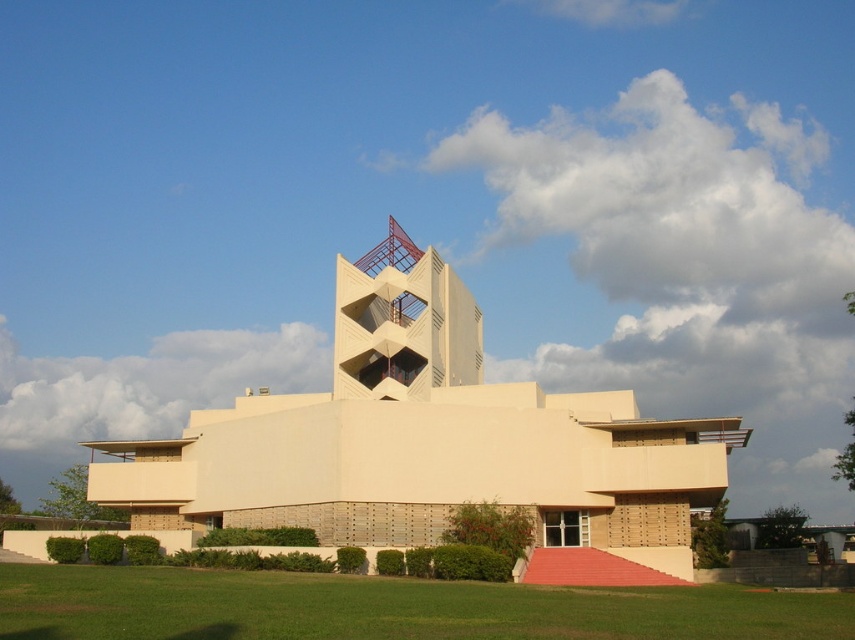
Can you confirm if beige concrete building at center is smaller than green grass at lower center?

No, beige concrete building at center is not smaller than green grass at lower center.

Is beige concrete building at center thinner than green grass at lower center?

No.

Who is more forward, (289, 433) or (578, 636)?

Positioned in front is point (578, 636).

Locate an element on the screen. beige concrete building at center is located at coordinates (426, 440).